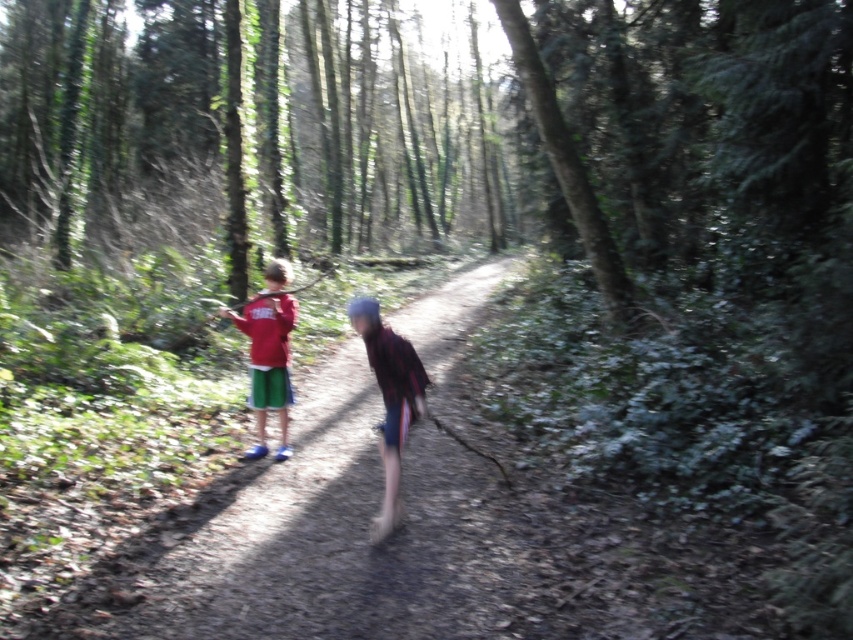
You are a hiker trying to navigate through the forest path. You notice the green leafy tree at center and the matte red shirt at left. Which object would block your view more if you were standing at the path?

The green leafy tree at center would block your view more than the matte red shirt at left because it is larger in size.

You are a hiker who wants to take a photo of the green leafy tree at center and the plaid fabric shirt at center from a position where both are visible in the frame. Based on their positions, can you stand in a spot where you can see both objects at the same time?

Yes, since the green leafy tree at center is above the plaid fabric shirt at center, you can stand at a position where both are visible in the frame by looking upwards to include the tree and downwards slightly to include the shirt.

You are a photographer trying to capture both the plaid fabric shirt at center and the matte red shirt at left in a single frame. Based on their sizes in the image, which shirt should you focus on to ensure both are visible without cropping?

The plaid fabric shirt at center occupies less space than the matte red shirt at left, so focusing on the matte red shirt at left would allow the smaller plaid fabric shirt at center to fit into the frame more easily.